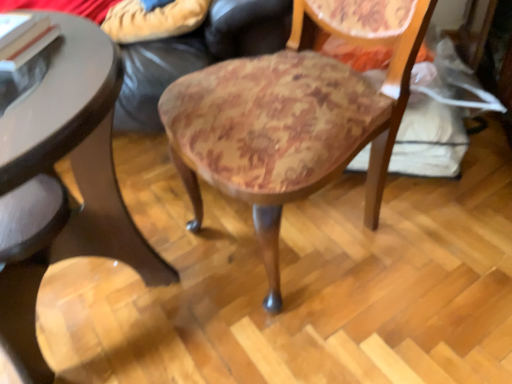
Where is `vacant space in front of wooden upholstered chair at center`? vacant space in front of wooden upholstered chair at center is located at coordinates (327, 332).